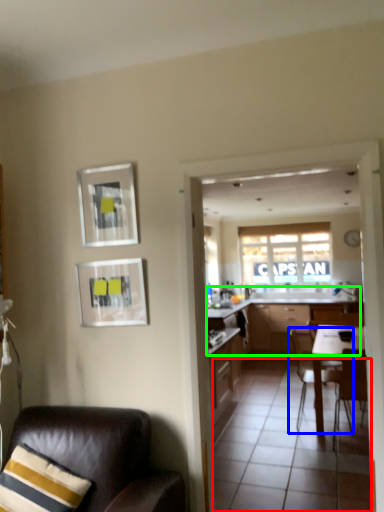
Question: Estimate the real-world distances between objects in this image. Which object is closer to tile (highlighted by a red box), chair (highlighted by a blue box) or cabinetry (highlighted by a green box)?

Choices:
 (A) chair
 (B) cabinetry

Answer: (A)